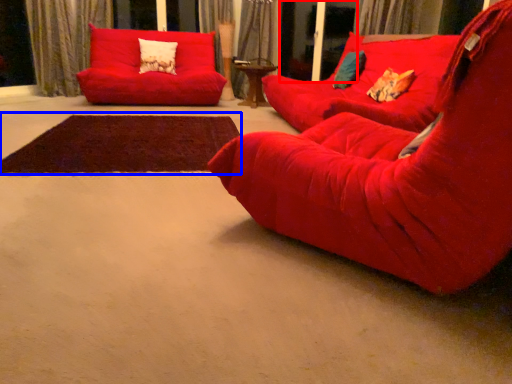
Question: Which point is further to the camera, screen door (highlighted by a red box) or mat (highlighted by a blue box)?

Choices:
 (A) screen door
 (B) mat

Answer: (A)